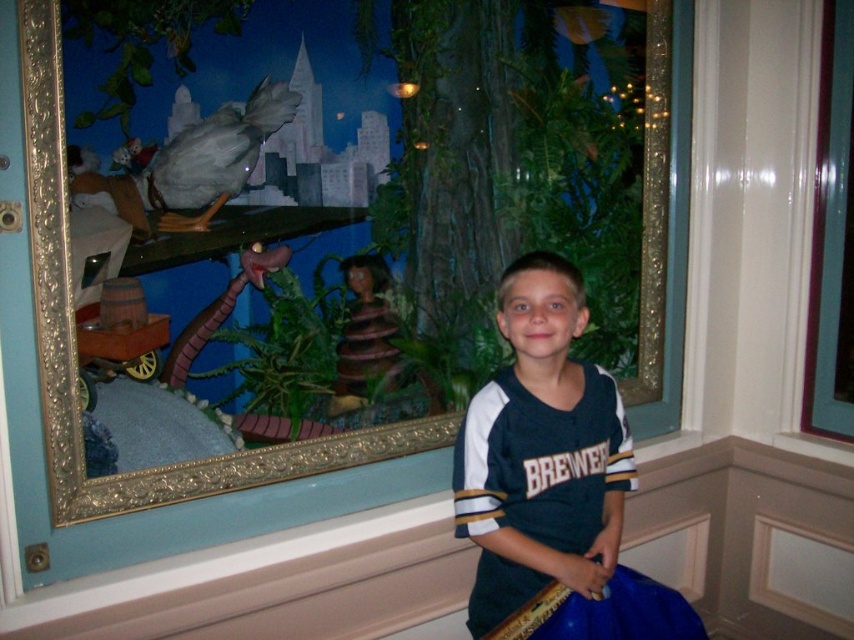
Does dark blue jersey at center have a larger size compared to transparent glass window at upper right?

Indeed, dark blue jersey at center has a larger size compared to transparent glass window at upper right.

Looking at this image, is dark blue jersey at center thinner than transparent glass window at upper right?

No.

Who is more forward, (537,444) or (837,394)?

Point (537,444)

Find the location of a particular element. dark blue jersey at center is located at coordinates (553, 480).